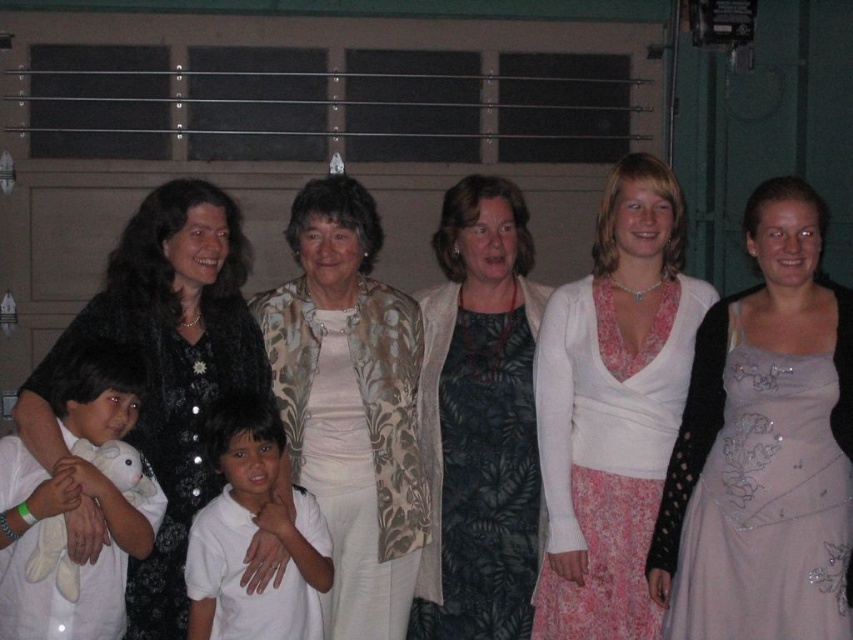
The image size is (853, 640). What do you see at coordinates (612, 406) in the screenshot?
I see `white textured top at center` at bounding box center [612, 406].

Can you confirm if white textured top at center is positioned above floral-patterned jacket at center?

Indeed, white textured top at center is positioned over floral-patterned jacket at center.

Where is `white textured top at center`? white textured top at center is located at coordinates (612, 406).

At what (x,y) coordinates should I click in order to perform the action: click on white textured top at center. Please return your answer as a coordinate pair (x, y). Looking at the image, I should click on (612, 406).

Between black satin dress at left and white soft plush toy at left, which one has more height?

black satin dress at left is taller.

The image size is (853, 640). Describe the element at coordinates (166, 368) in the screenshot. I see `black satin dress at left` at that location.

Image resolution: width=853 pixels, height=640 pixels. What are the coordinates of `black satin dress at left` in the screenshot? It's located at (166, 368).

Between black satin dress at left and white smooth shirt at center, which one has less height?

Standing shorter between the two is white smooth shirt at center.

This screenshot has height=640, width=853. Describe the element at coordinates (166, 368) in the screenshot. I see `black satin dress at left` at that location.

At what (x,y) coordinates should I click in order to perform the action: click on black satin dress at left. Please return your answer as a coordinate pair (x, y). Looking at the image, I should click on (166, 368).